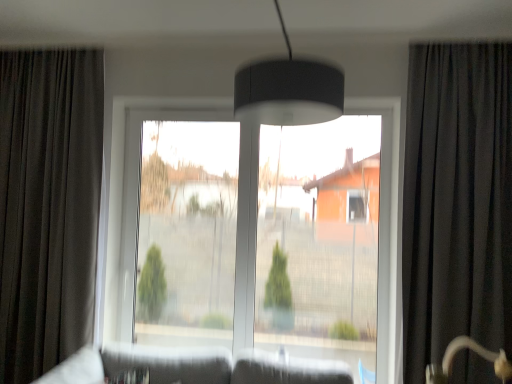
Question: Considering the relative sizes of transparent glass window at center and transparent glass window screen at center in the image provided, is transparent glass window at center taller than transparent glass window screen at center?

Choices:
 (A) no
 (B) yes

Answer: (B)

Question: Is transparent glass window at center bigger than transparent glass window screen at center?

Choices:
 (A) yes
 (B) no

Answer: (A)

Question: Is transparent glass window at center shorter than transparent glass window screen at center?

Choices:
 (A) no
 (B) yes

Answer: (A)

Question: Considering the relative positions of transparent glass window at center and transparent glass window screen at center in the image provided, is transparent glass window at center to the left of transparent glass window screen at center from the viewer's perspective?

Choices:
 (A) yes
 (B) no

Answer: (B)

Question: Can transparent glass window screen at center be found inside transparent glass window at center?

Choices:
 (A) yes
 (B) no

Answer: (A)

Question: Is black velvet curtain at right, marked as the second curtain in a left-to-right arrangement, taller or shorter than transparent glass window at center?

Choices:
 (A) short
 (B) tall

Answer: (B)

Question: Based on their positions, is black velvet curtain at right, marked as the second curtain in a left-to-right arrangement, located to the left or right of transparent glass window at center?

Choices:
 (A) left
 (B) right

Answer: (B)

Question: From a real-world perspective, is black velvet curtain at right, which is the 1th curtain from right to left, physically located above or below transparent glass window at center?

Choices:
 (A) below
 (B) above

Answer: (B)

Question: Is black velvet curtain at right, which is the 1th curtain from right to left, in front of or behind transparent glass window at center in the image?

Choices:
 (A) behind
 (B) front

Answer: (B)

Question: From a real-world perspective, is transparent glass window at center physically located above or below dark grey fabric curtain at left, acting as the first curtain starting from the left?

Choices:
 (A) below
 (B) above

Answer: (A)

Question: Would you say transparent glass window at center is to the left or to the right of dark grey fabric curtain at left, the 2th curtain from the right, in the picture?

Choices:
 (A) left
 (B) right

Answer: (B)

Question: From the image's perspective, is transparent glass window at center located above or below dark grey fabric curtain at left, acting as the first curtain starting from the left?

Choices:
 (A) above
 (B) below

Answer: (B)

Question: Looking at their shapes, would you say transparent glass window at center is wider or thinner than dark grey fabric curtain at left, the 2th curtain from the right?

Choices:
 (A) thin
 (B) wide

Answer: (A)

Question: In terms of width, does transparent glass window screen at center look wider or thinner when compared to black velvet curtain at right, marked as the second curtain in a left-to-right arrangement?

Choices:
 (A) wide
 (B) thin

Answer: (B)

Question: From their relative heights in the image, would you say transparent glass window screen at center is taller or shorter than black velvet curtain at right, which is the 1th curtain from right to left?

Choices:
 (A) tall
 (B) short

Answer: (B)